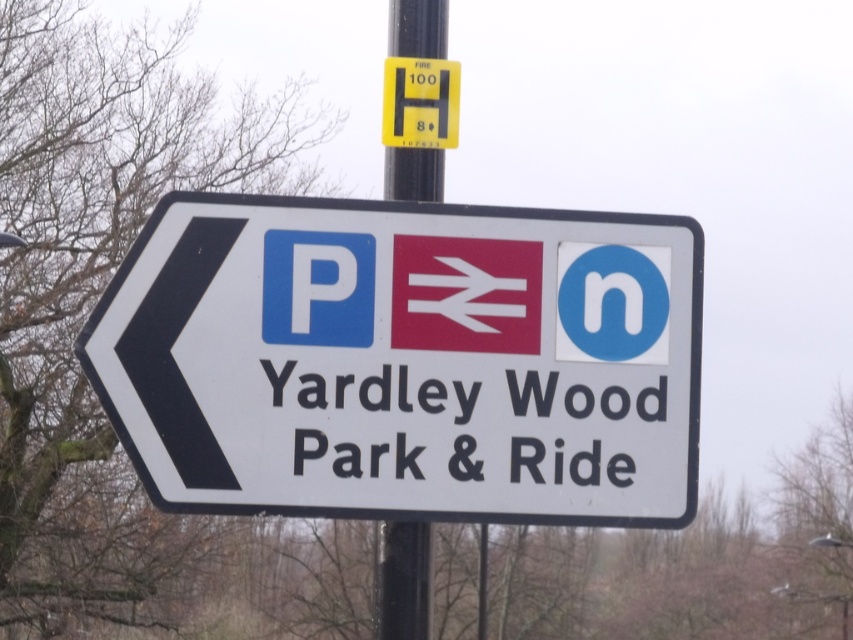
From the picture: You are a delivery driver who needs to attach a new sticker to the white plastic sign at center and the metallic pole at upper center. If your sticker is 10 inches wide, which object will it fit better on?

The white plastic sign at center has a larger width than the metallic pole at upper center, so the sticker will fit better on the white plastic sign at center.

You are a pedestrian trying to find the park and ride. You see the white plastic sign at center and the metallic pole at upper center. Which object is positioned lower?

The white plastic sign at center is positioned lower than the metallic pole at upper center.

You are standing in front of the road sign and want to know the exact location of the white plastic sign at center. Can you determine its coordinates based on the description?

The white plastic sign at center is located at coordinates point (405, 360).